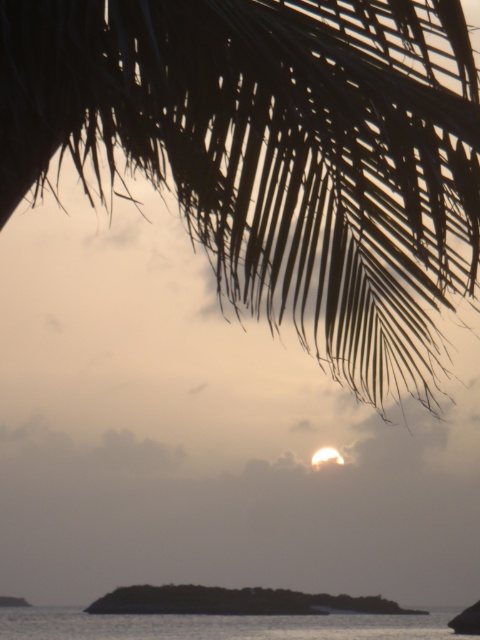
Locate an element on the screen. The image size is (480, 640). silky black palm fronds at upper center is located at coordinates (275, 154).

Who is more distant from viewer, (x=290, y=260) or (x=440, y=609)?

The point (x=440, y=609) is more distant.

Locate an element on the screen. The width and height of the screenshot is (480, 640). silky black palm fronds at upper center is located at coordinates (275, 154).